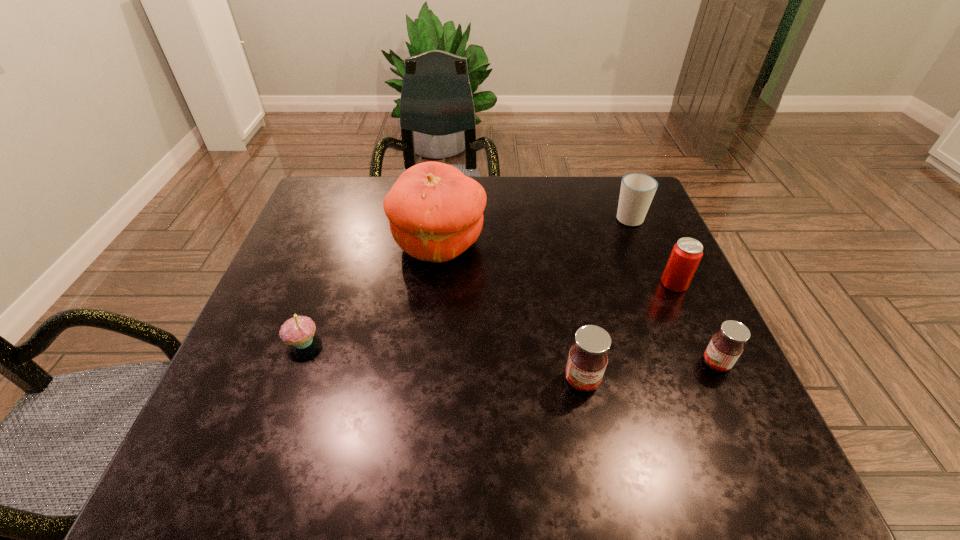
Locate which object ranks fifth in proximity to the leftmost object. Please provide its 2D coordinates. Your answer should be formatted as a tuple, i.e. [(x, y)], where the tuple contains the x and y coordinates of a point satisfying the conditions above.

[(637, 190)]

Identify which object is the fifth closest to the cupcake. Please provide its 2D coordinates. Your answer should be formatted as a tuple, i.e. [(x, y)], where the tuple contains the x and y coordinates of a point satisfying the conditions above.

[(637, 190)]

Locate an element on the screen. This screenshot has width=960, height=540. vacant space that satisfies the following two spatial constraints: 1. on the back side of the fifth object from right to left; 2. on the right side of the cupcake is located at coordinates (338, 244).

Identify the location of free location that satisfies the following two spatial constraints: 1. on the label side of the shorter jam; 2. on the label side of the fourth object from right to left. The height and width of the screenshot is (540, 960). (724, 380).